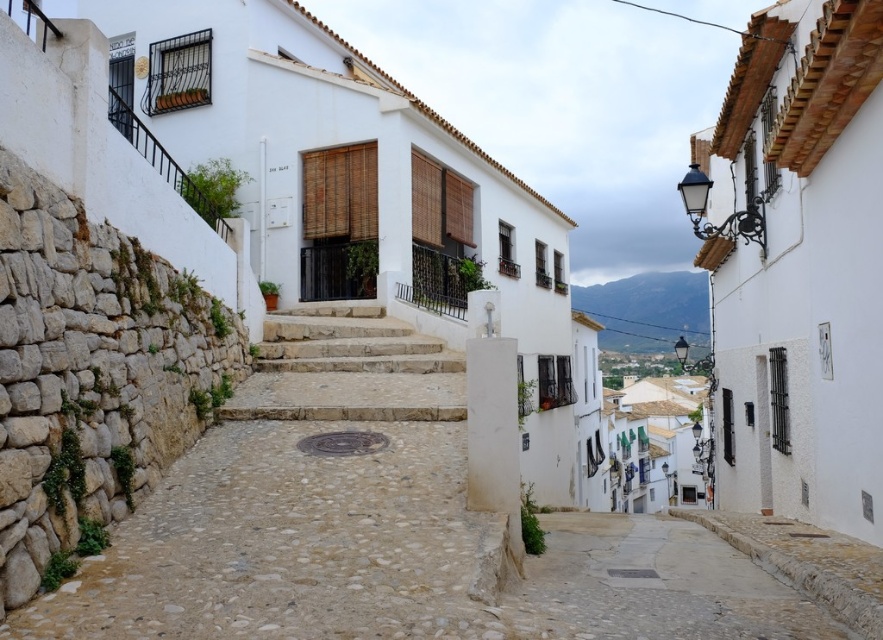
Does smooth stone path at lower center appear over natural stone stairs at center?

Incorrect, smooth stone path at lower center is not positioned above natural stone stairs at center.

Which is more to the right, smooth stone path at lower center or natural stone stairs at center?

smooth stone path at lower center is more to the right.

Does point (643, 586) come behind point (405, 403)?

No, (643, 586) is in front of (405, 403).

In order to click on smooth stone path at lower center in this screenshot , I will do `click(655, 586)`.

Who is shorter, natural stone path at center or natural stone stairs at center?

natural stone stairs at center is shorter.

Does natural stone path at center have a greater width compared to natural stone stairs at center?

Yes.

Between point (260, 385) and point (383, 362), which one is positioned behind?

Point (383, 362)

Image resolution: width=883 pixels, height=640 pixels. Find the location of `natural stone path at center`. natural stone path at center is located at coordinates (304, 508).

Consider the image. Which of these two, natural stone path at center or smooth stone path at lower center, stands shorter?

Standing shorter between the two is smooth stone path at lower center.

Does natural stone path at center appear on the left side of smooth stone path at lower center?

Indeed, natural stone path at center is positioned on the left side of smooth stone path at lower center.

Describe the element at coordinates (304, 508) in the screenshot. I see `natural stone path at center` at that location.

This screenshot has width=883, height=640. I want to click on natural stone path at center, so click(x=304, y=508).